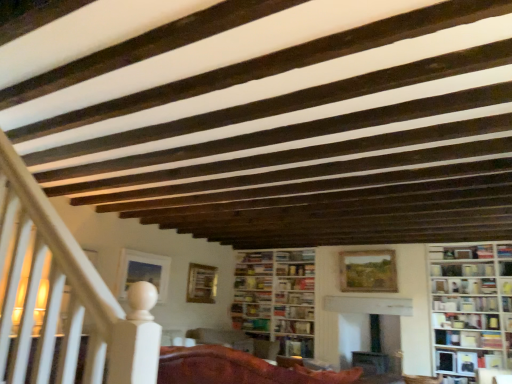
Question: Is point (310, 327) closer or farther from the camera than point (285, 281)?

Choices:
 (A) closer
 (B) farther

Answer: (A)

Question: Considering their positions, is hardcover book at center, which appears as the fifth book when viewed from the top, located in front of or behind hardcover book at center, the fourth book from the bottom?

Choices:
 (A) front
 (B) behind

Answer: (A)

Question: Which object is the farthest from the mahogany wood chair at center?

Choices:
 (A) gold metallic picture frame at upper center, the second picture frame viewed from the left
 (B) matte white bookshelf at lower right, the fourth book in the top-to-bottom sequence
 (C) matte wooden picture frame at upper left, the 3th picture frame positioned from the right
 (D) wooden textured picture frame at center, which is the 1th picture frame from right to left
 (E) hardcover book at center, positioned as the 2th book in bottom-to-top order

Answer: (B)

Question: Estimate the real-world distances between objects in this image. Which object is farther from the white wooden bookcase at right, which is counted as the 2th bookcase, starting from the left?

Choices:
 (A) hardcover book at center, which ranks as the 3th book in top-to-bottom order
 (B) hardcover book at center, which appears as the fifth book when viewed from the top
 (C) gold metallic picture frame at upper center, the second picture frame viewed from the left
 (D) white matte bookshelf at center, which is the 2th book from top to bottom
 (E) wooden textured picture frame at center, which is the 1th picture frame from right to left

Answer: (C)